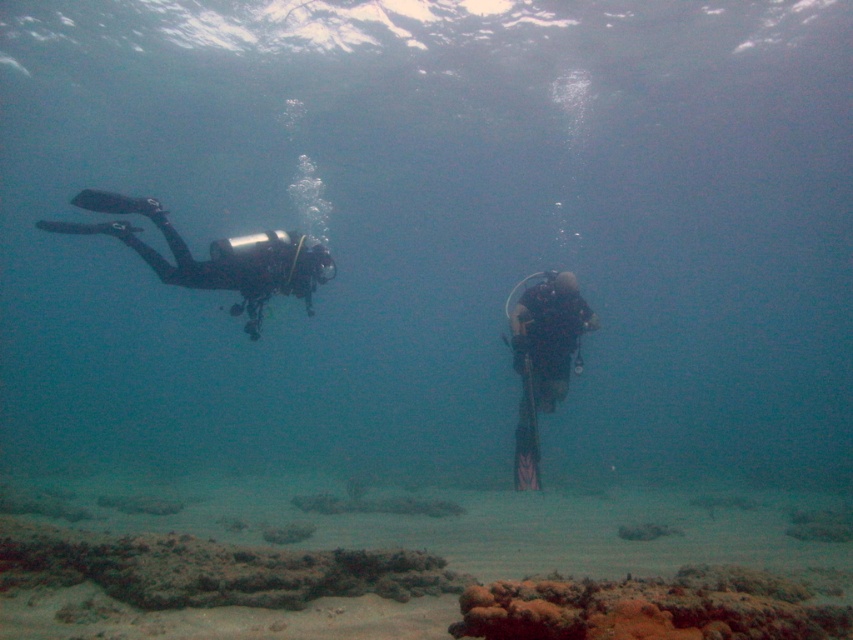
Which of these two, black matte scuba diver at left or black matte scuba diver at center, stands shorter?

With less height is black matte scuba diver at left.

Which is more to the left, black matte scuba diver at left or black matte scuba diver at center?

From the viewer's perspective, black matte scuba diver at left appears more on the left side.

Between point (206, 269) and point (531, 454), which one is positioned behind?

The point (206, 269) is behind.

At what (x,y) coordinates should I click in order to perform the action: click on black matte scuba diver at left. Please return your answer as a coordinate pair (x, y). Looking at the image, I should click on (215, 256).